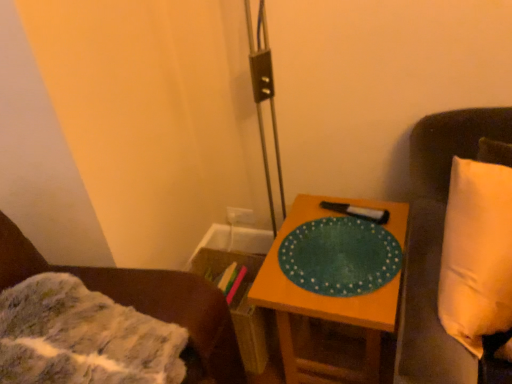
What are the coordinates of `vacant space underneath green matte platter at center-right (from a real-world perspective)` in the screenshot? It's located at (334, 247).